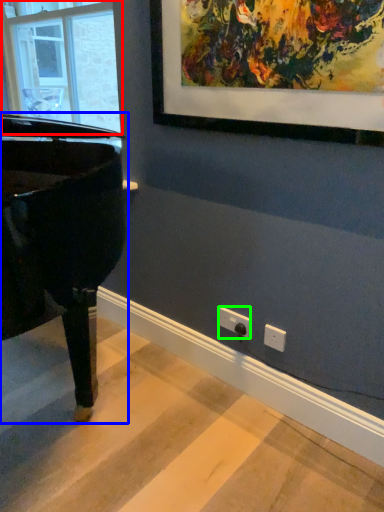
Question: Which is nearer to the window (highlighted by a red box)? piano (highlighted by a blue box) or electric outlet (highlighted by a green box).

Choices:
 (A) piano
 (B) electric outlet

Answer: (A)